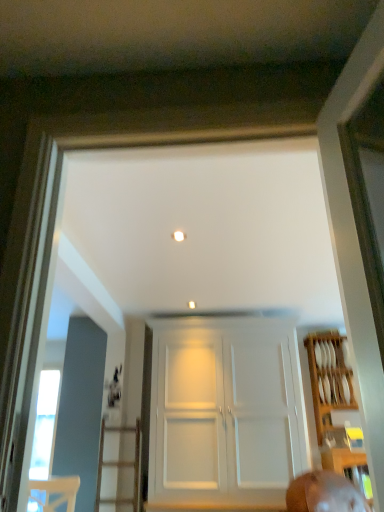
Find the location of a particular element. wooden plate rack at right is located at coordinates (329, 373).

Image resolution: width=384 pixels, height=512 pixels. What do you see at coordinates (329, 373) in the screenshot?
I see `wooden plate rack at right` at bounding box center [329, 373].

What is the approximate width of wooden plate rack at right?

wooden plate rack at right is 10.57 inches wide.

Describe the element at coordinates (225, 417) in the screenshot. This screenshot has height=512, width=384. I see `white matte door at center` at that location.

Find the location of a particular element. The image size is (384, 512). white matte door at center is located at coordinates (225, 417).

At what (x,y) coordinates should I click in order to perform the action: click on wooden plate rack at right. Please return your answer as a coordinate pair (x, y). The height and width of the screenshot is (512, 384). Looking at the image, I should click on (329, 373).

Looking at this image, considering the positions of objects wooden plate rack at right and white matte door at center in the image provided, who is more to the right, wooden plate rack at right or white matte door at center?

wooden plate rack at right.

Which object is further away from the camera taking this photo, wooden plate rack at right or white matte door at center?

Positioned behind is wooden plate rack at right.

Is point (315, 390) closer or farther from the camera than point (169, 490)?

Point (315, 390) appears to be farther away from the viewer than point (169, 490).

From the image's perspective, is wooden plate rack at right located above or below white matte door at center?

Clearly, from the image's perspective, wooden plate rack at right is above white matte door at center.

From a real-world perspective, who is located higher, wooden plate rack at right or white matte door at center?

wooden plate rack at right, from a real-world perspective.

Between wooden plate rack at right and white matte door at center, which one has smaller width?

wooden plate rack at right is thinner.

Can you confirm if wooden plate rack at right is taller than white matte door at center?

No.

Considering the relative sizes of wooden plate rack at right and white matte door at center in the image provided, is wooden plate rack at right bigger than white matte door at center?

Incorrect, wooden plate rack at right is not larger than white matte door at center.

Is wooden plate rack at right inside the boundaries of white matte door at center, or outside?

The correct answer is: outside.

Is wooden plate rack at right touching white matte door at center?

wooden plate rack at right is not next to white matte door at center, and they're not touching.

Could you tell me if wooden plate rack at right is facing white matte door at center?

No, wooden plate rack at right is not aimed at white matte door at center.

Find the location of a particular element. The image size is (384, 512). door below the wooden plate rack at right (from the image's perspective) is located at coordinates (225, 417).

Which is more to the left, white matte door at center or wooden plate rack at right?

Positioned to the left is white matte door at center.

Which object is further away from the camera, white matte door at center or wooden plate rack at right?

wooden plate rack at right.

Does point (257, 473) come closer to viewer compared to point (317, 371)?

Yes, it is.

From the image's perspective, is white matte door at center above or below wooden plate rack at right?

From the image's perspective, white matte door at center appears below wooden plate rack at right.

From a real-world perspective, relative to wooden plate rack at right, is white matte door at center vertically above or below?

white matte door at center is below wooden plate rack at right.

Does white matte door at center have a lesser width compared to wooden plate rack at right?

No, white matte door at center is not thinner than wooden plate rack at right.

Can you confirm if white matte door at center is shorter than wooden plate rack at right?

No, white matte door at center is not shorter than wooden plate rack at right.

Is white matte door at center smaller than wooden plate rack at right?

Actually, white matte door at center might be larger than wooden plate rack at right.

Is white matte door at center inside the boundaries of wooden plate rack at right, or outside?

white matte door at center is not enclosed by wooden plate rack at right.

Is the surface of white matte door at center in direct contact with wooden plate rack at right?

No, white matte door at center is not in contact with wooden plate rack at right.

Is white matte door at center aimed at wooden plate rack at right?

No, white matte door at center is not oriented towards wooden plate rack at right.

The image size is (384, 512). I want to click on shelf behind the white matte door at center, so click(x=329, y=373).

What are the coordinates of `shelf above the white matte door at center (from a real-world perspective)` in the screenshot? It's located at (329, 373).

Where is `shelf behind the white matte door at center`? Image resolution: width=384 pixels, height=512 pixels. shelf behind the white matte door at center is located at coordinates (329, 373).